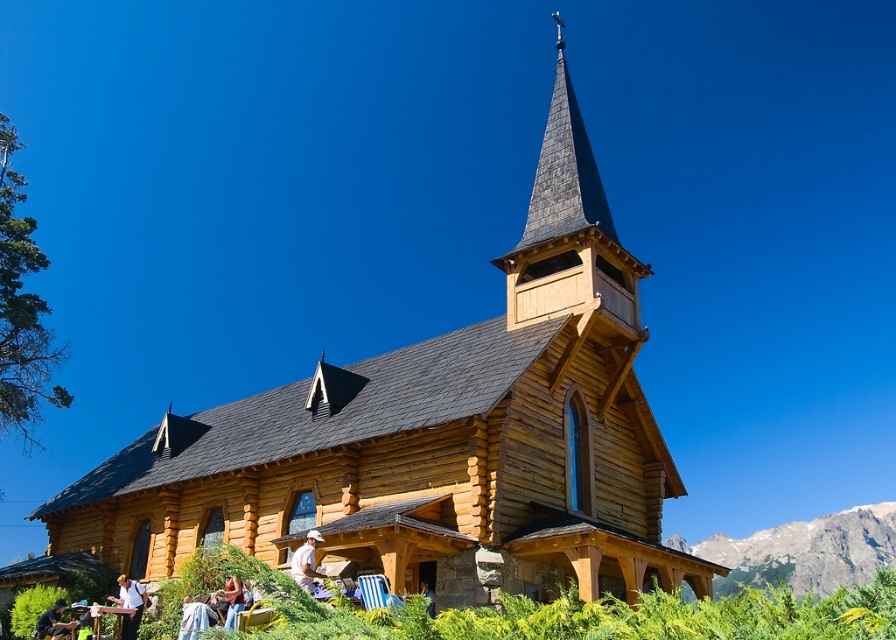
Question: Does wooden shingles steeple at upper center appear under denim jacket at lower center?

Choices:
 (A) no
 (B) yes

Answer: (A)

Question: Estimate the real-world distances between objects in this image. Which object is farther from the green leafy hillside at lower right?

Choices:
 (A) white cotton shirt at lower center
 (B) denim jacket at lower center
 (C) wooden shingles steeple at upper center

Answer: (B)

Question: Is green leafy hillside at lower right to the left of denim jacket at lower center from the viewer's perspective?

Choices:
 (A) no
 (B) yes

Answer: (A)

Question: In this image, where is green leafy hillside at lower right located relative to denim jacket at lower left?

Choices:
 (A) left
 (B) right

Answer: (B)

Question: Which is farther from the denim jacket at lower center?

Choices:
 (A) green leafy hillside at lower right
 (B) wooden shingles steeple at upper center

Answer: (A)

Question: Which of the following is the closest to the observer?

Choices:
 (A) denim jacket at lower center
 (B) green leafy hillside at lower right

Answer: (A)